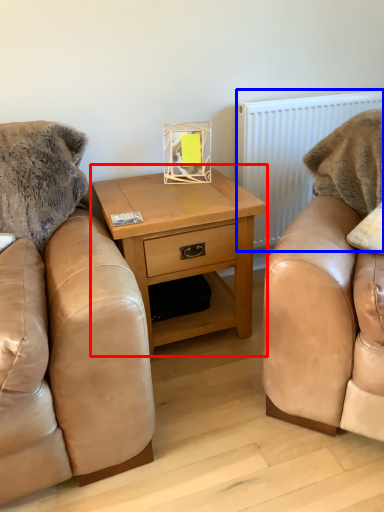
Question: Which point is closer to the camera, nightstand (highlighted by a red box) or radiator (highlighted by a blue box)?

Choices:
 (A) nightstand
 (B) radiator

Answer: (A)